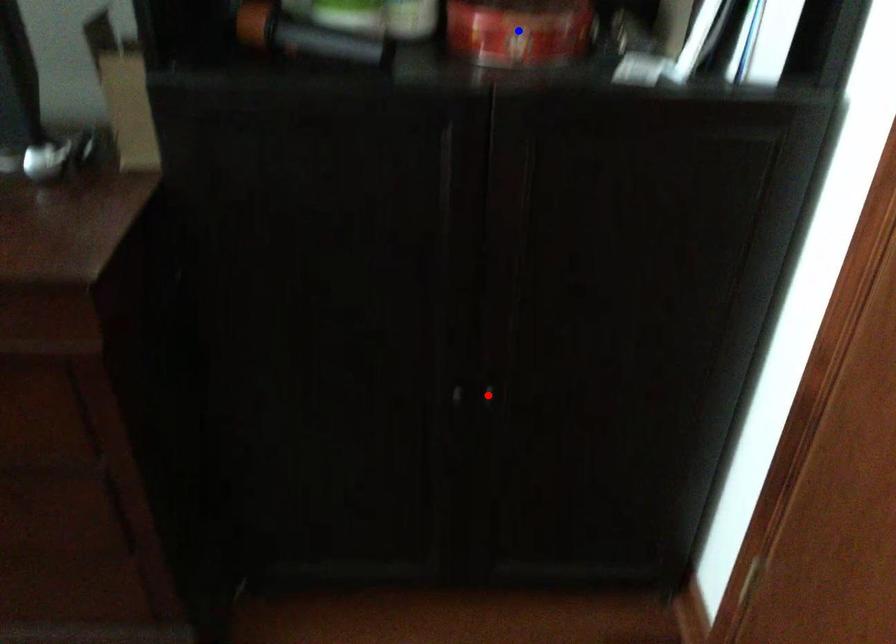
Question: In the image, two points are highlighted. Which point is nearer to the camera? Reply with the corresponding letter.

Choices:
 (A) blue point
 (B) red point

Answer: (A)